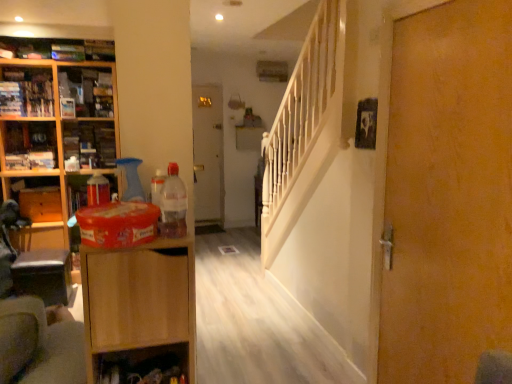
The width and height of the screenshot is (512, 384). What do you see at coordinates (30, 145) in the screenshot? I see `wooden cabinet at left, acting as the 2th cabinet starting from the bottom` at bounding box center [30, 145].

How much space does wooden cabinet at left, marked as the second cabinet in a left-to-right arrangement, occupy horizontally?

wooden cabinet at left, marked as the second cabinet in a left-to-right arrangement, is 7.22 inches wide.

The width and height of the screenshot is (512, 384). I want to click on wooden table at lower left, so click(44, 276).

Find the location of a particular element. wooden door at right, the first door in the front-to-back sequence is located at coordinates (448, 194).

The image size is (512, 384). Describe the element at coordinates (41, 204) in the screenshot. I see `wooden drawer at left` at that location.

Describe the element at coordinates (208, 153) in the screenshot. I see `white glossy door at center, the 1th door in the left-to-right sequence` at that location.

In order to click on wooden cabinet at left, the 2th cabinet viewed from the right in this screenshot , I will do `click(30, 145)`.

Does wooden table at lower left have a lesser width compared to wooden drawer at left?

No, wooden table at lower left is not thinner than wooden drawer at left.

Is wooden table at lower left outside of wooden drawer at left?

That's correct, wooden table at lower left is outside of wooden drawer at left.

Which of these two, wooden table at lower left or wooden drawer at left, stands taller?

wooden table at lower left.

Considering their positions, is wooden table at lower left located in front of or behind wooden drawer at left?

Visually, wooden table at lower left is located in front of wooden drawer at left.

Would you say wooden drawer at left is outside translucent plastic bottle at center?

Yes.

From a real-world perspective, who is located lower, wooden drawer at left or translucent plastic bottle at center?

From a 3D spatial view, wooden drawer at left is below.

Which object is thinner, wooden drawer at left or translucent plastic bottle at center?

Thinner between the two is translucent plastic bottle at center.

Does wooden bookshelf at upper left, the third cabinet viewed from the right, contain wooden cabinet at left, marked as the second cabinet in a left-to-right arrangement?

Actually, wooden cabinet at left, marked as the second cabinet in a left-to-right arrangement, is outside wooden bookshelf at upper left, the third cabinet viewed from the right.

This screenshot has width=512, height=384. What are the coordinates of `cabinet located above the wooden cabinet at left, the 2th cabinet viewed from the right (from a real-world perspective)` in the screenshot? It's located at [x=26, y=92].

Is wooden bookshelf at upper left, the third cabinet from the bottom, smaller than wooden cabinet at left, the 2th cabinet viewed from the right?

Indeed, wooden bookshelf at upper left, the third cabinet from the bottom, has a smaller size compared to wooden cabinet at left, the 2th cabinet viewed from the right.

Would you consider wooden bookshelf at upper left, the 1th cabinet viewed from the left, to be distant from wooden cabinet at left, acting as the 2th cabinet starting from the top?

No, wooden bookshelf at upper left, the 1th cabinet viewed from the left, is not far from wooden cabinet at left, acting as the 2th cabinet starting from the top.

Is wooden cabinet at left, placed as the 2th cabinetry when sorted from front to back, inside the boundaries of translucent plastic bottle at center, or outside?

wooden cabinet at left, placed as the 2th cabinetry when sorted from front to back, exists outside the volume of translucent plastic bottle at center.

Is wooden cabinet at left, placed as the 2th cabinetry when sorted from front to back, positioned far away from translucent plastic bottle at center?

That's right, there is a large distance between wooden cabinet at left, placed as the 2th cabinetry when sorted from front to back, and translucent plastic bottle at center.

Where is `cabinetry behind the translucent plastic bottle at center`? This screenshot has height=384, width=512. cabinetry behind the translucent plastic bottle at center is located at coordinates (55, 132).

Between wooden cabinet at left, which is the second cabinetry in right-to-left order, and translucent plastic bottle at center, which one has smaller width?

With smaller width is translucent plastic bottle at center.

Which object is closer to the camera taking this photo, light brown wood cabinet at left, the 1th cabinetry from the right, or matte plastic container at left, arranged as the 3th cabinet when viewed from the back?

light brown wood cabinet at left, the 1th cabinetry from the right.

Is light brown wood cabinet at left, which is the 2th cabinetry from left to right, far away from matte plastic container at left, which appears as the 3th cabinet when viewed from the top?

light brown wood cabinet at left, which is the 2th cabinetry from left to right, is far away from matte plastic container at left, which appears as the 3th cabinet when viewed from the top.

Could you tell me if light brown wood cabinet at left, the first cabinetry from the front, is facing matte plastic container at left, which appears as the 3th cabinet when viewed from the top?

No.

Looking at this image, is light brown wood cabinet at left, the 1th cabinetry from the right, situated inside matte plastic container at left, which appears as the 1th cabinet when viewed from the front, or outside?

light brown wood cabinet at left, the 1th cabinetry from the right, is not inside matte plastic container at left, which appears as the 1th cabinet when viewed from the front, it's outside.

Find the location of a particular element. The height and width of the screenshot is (384, 512). the 2nd cabinet to the right when counting from the wooden bookshelf at upper left, which appears as the 2th cabinet when viewed from the back is located at coordinates (90, 190).

From the image's perspective, which is below, wooden bookshelf at upper left, the third cabinet viewed from the right, or matte plastic container at left, which appears as the 3th cabinet when viewed from the top?

matte plastic container at left, which appears as the 3th cabinet when viewed from the top.

Would you say wooden bookshelf at upper left, the 1th cabinet when ordered from top to bottom, contains matte plastic container at left, positioned as the first cabinet in bottom-to-top order?

No, wooden bookshelf at upper left, the 1th cabinet when ordered from top to bottom, does not contain matte plastic container at left, positioned as the first cabinet in bottom-to-top order.

Considering the positions of objects wooden bookshelf at upper left, the 1th cabinet viewed from the left, and matte plastic container at left, which appears as the 3th cabinet when viewed from the top, in the image provided, who is more to the right, wooden bookshelf at upper left, the 1th cabinet viewed from the left, or matte plastic container at left, which appears as the 3th cabinet when viewed from the top,?

From the viewer's perspective, matte plastic container at left, which appears as the 3th cabinet when viewed from the top, appears more on the right side.

Is wooden shelf at lower center located within white glossy door at center, acting as the 2th door starting from the front?

No, wooden shelf at lower center is not inside white glossy door at center, acting as the 2th door starting from the front.

Can you confirm if white glossy door at center, acting as the 2th door starting from the front, is smaller than wooden shelf at lower center?

Incorrect, white glossy door at center, acting as the 2th door starting from the front, is not smaller in size than wooden shelf at lower center.

In the image, there is a wooden table at lower left. Where is `drawer above it (from the image's perspective)`? This screenshot has height=384, width=512. drawer above it (from the image's perspective) is located at coordinates (41, 204).

You are a GUI agent. You are given a task and a screenshot of the screen. Output one action in this format:
    pyautogui.click(x=<x>, y=<y>)
    Task: Click on the bottle in front of the wooden drawer at left
    
    Given the screenshot: What is the action you would take?
    pyautogui.click(x=173, y=204)

Estimate the real-world distances between objects in this image. Which object is further from wooden shelf at lower center, wooden bookshelf at upper left, the third cabinet from the bottom, or translucent plastic bottle at center?

wooden bookshelf at upper left, the third cabinet from the bottom, lies further to wooden shelf at lower center than the other object.

Based on their spatial positions, is wooden table at lower left or wooden drawer at left further from wooden shelf at lower center?

wooden drawer at left is further to wooden shelf at lower center.

From the image, which object appears to be nearer to wooden cabinet at left, which appears as the third cabinet when viewed from the front, matte plastic container at left, arranged as the 3th cabinet when viewed from the back, or white glossy door at center, the 1th door in the left-to-right sequence?

Among the two, matte plastic container at left, arranged as the 3th cabinet when viewed from the back, is located nearer to wooden cabinet at left, which appears as the third cabinet when viewed from the front.

From the image, which object appears to be nearer to light brown wood cabinet at left, the 1th cabinetry from the right, wooden table at lower left or wooden door at right, the first door positioned from the right?

The object closer to light brown wood cabinet at left, the 1th cabinetry from the right, is wooden door at right, the first door positioned from the right.

Considering their positions, is wooden drawer at left positioned closer to wooden table at lower left than wooden cabinet at left, which appears as the 1th cabinetry when viewed from the back?

wooden drawer at left is positioned closer to the anchor wooden table at lower left.

Estimate the real-world distances between objects in this image. Which object is further from wooden bookshelf at upper left, which appears as the 2th cabinet when viewed from the back, wooden shelf at lower center or light brown wood cabinet at left, the first cabinetry from the front?

The object further to wooden bookshelf at upper left, which appears as the 2th cabinet when viewed from the back, is light brown wood cabinet at left, the first cabinetry from the front.

When comparing their distances from light brown wood cabinet at left, which is the 2th cabinetry from left to right, does wooden door at right, positioned as the second door in back-to-front order, or wooden drawer at left seem closer?

Based on the image, wooden door at right, positioned as the second door in back-to-front order, appears to be nearer to light brown wood cabinet at left, which is the 2th cabinetry from left to right.

From the image, which object appears to be nearer to light brown wood cabinet at left, the first cabinetry from the front, wooden cabinet at left, which appears as the third cabinet when viewed from the front, or wooden door at right, the first door positioned from the right?

wooden door at right, the first door positioned from the right, is closer to light brown wood cabinet at left, the first cabinetry from the front.

Locate an element on the screen. The image size is (512, 384). table located between light brown wood cabinet at left, which is the 2th cabinetry from left to right, and wooden drawer at left in the depth direction is located at coordinates 44,276.

Identify the location of shelf located between translucent plastic bottle at center and wooden table at lower left in the depth direction. This screenshot has width=512, height=384. (144, 366).

Find the location of a particular element. table between translucent plastic bottle at center and white glossy door at center, the second door in the right-to-left sequence, from front to back is located at coordinates (44, 276).

You are a GUI agent. You are given a task and a screenshot of the screen. Output one action in this format:
    pyautogui.click(x=<x>, y=<y>)
    Task: Click on the shelf positioned between light brown wood cabinet at left, the 2th cabinetry in the back-to-front sequence, and wooden table at lower left from near to far
    The image size is (512, 384).
    Given the screenshot: What is the action you would take?
    pyautogui.click(x=144, y=366)